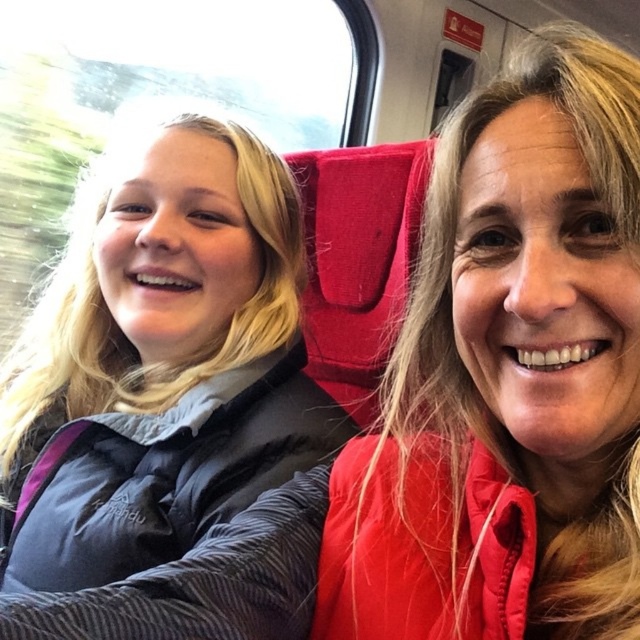
Question: Which point is farther from the camera taking this photo?

Choices:
 (A) (600, 118)
 (B) (44, 531)

Answer: (B)

Question: Which point appears closest to the camera in this image?

Choices:
 (A) (364, 604)
 (B) (285, 396)

Answer: (A)

Question: Which of the following is the closest to the observer?

Choices:
 (A) brushed nylon jacket at left
 (B) matte red jacket at right

Answer: (B)

Question: Does matte red jacket at right appear over brushed nylon jacket at left?

Choices:
 (A) yes
 (B) no

Answer: (A)

Question: Observing the image, what is the correct spatial positioning of matte red jacket at right in reference to brushed nylon jacket at left?

Choices:
 (A) right
 (B) left

Answer: (A)

Question: Can you confirm if matte red jacket at right is thinner than brushed nylon jacket at left?

Choices:
 (A) yes
 (B) no

Answer: (A)